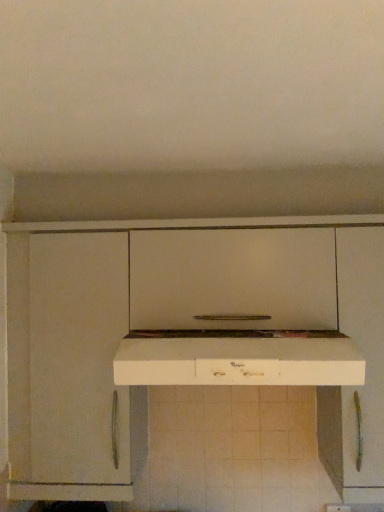
This screenshot has height=512, width=384. What do you see at coordinates (238, 358) in the screenshot?
I see `white matte countertop at center` at bounding box center [238, 358].

Where is `white matte countertop at center`? The image size is (384, 512). white matte countertop at center is located at coordinates (238, 358).

Find the location of `white matte countertop at center`. white matte countertop at center is located at coordinates (238, 358).